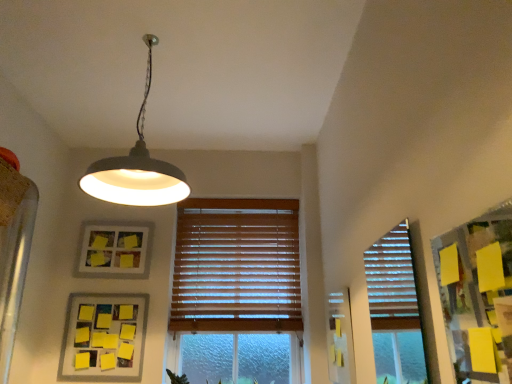
Image resolution: width=512 pixels, height=384 pixels. Describe the element at coordinates (114, 249) in the screenshot. I see `yellow matte picture frame at upper left, the first picture frame viewed from the top` at that location.

Describe the element at coordinates (136, 167) in the screenshot. I see `matte gray lampshade at upper center` at that location.

At what (x,y) coordinates should I click in order to perform the action: click on yellow matte picture frame at upper left, which appears as the 2th picture frame when viewed from the front. Please return your answer as a coordinate pair (x, y). This screenshot has width=512, height=384. Looking at the image, I should click on (114, 249).

Considering the sizes of objects yellow matte picture frame at lower left, placed as the second picture frame when sorted from top to bottom, and wooden blinds at center in the image provided, who is thinner, yellow matte picture frame at lower left, placed as the second picture frame when sorted from top to bottom, or wooden blinds at center?

yellow matte picture frame at lower left, placed as the second picture frame when sorted from top to bottom, is thinner.

Considering the relative sizes of yellow matte picture frame at lower left, which is the 2th picture frame from back to front, and wooden blinds at center in the image provided, is yellow matte picture frame at lower left, which is the 2th picture frame from back to front, bigger than wooden blinds at center?

Incorrect, yellow matte picture frame at lower left, which is the 2th picture frame from back to front, is not larger than wooden blinds at center.

The width and height of the screenshot is (512, 384). Find the location of `window that appears above the yellow matte picture frame at lower left, which appears as the 1th picture frame when viewed from the front (from the image's perspective)`. window that appears above the yellow matte picture frame at lower left, which appears as the 1th picture frame when viewed from the front (from the image's perspective) is located at coordinates (236, 266).

Between yellow matte picture frame at lower left, which is the 2th picture frame from back to front, and wooden blinds at center, which one appears on the left side from the viewer's perspective?

Positioned to the left is yellow matte picture frame at lower left, which is the 2th picture frame from back to front.

Based on the photo, does wooden blinds at center touch matte gray lampshade at upper center?

wooden blinds at center and matte gray lampshade at upper center are not in contact.

From their relative heights in the image, would you say wooden blinds at center is taller or shorter than matte gray lampshade at upper center?

Considering their sizes, wooden blinds at center has more height than matte gray lampshade at upper center.

Does wooden blinds at center have a lesser width compared to matte gray lampshade at upper center?

Yes, wooden blinds at center is thinner than matte gray lampshade at upper center.

Would you say wooden blinds at center is inside or outside matte gray lampshade at upper center?

wooden blinds at center is spatially situated outside matte gray lampshade at upper center.

How many degrees apart are the facing directions of yellow matte picture frame at upper left, the first picture frame viewed from the top, and matte gray lampshade at upper center?

yellow matte picture frame at upper left, the first picture frame viewed from the top, and matte gray lampshade at upper center are facing 5.44 degrees away from each other.

Is yellow matte picture frame at upper left, which appears as the 2th picture frame when viewed from the front, in front of or behind matte gray lampshade at upper center in the image?

Visually, yellow matte picture frame at upper left, which appears as the 2th picture frame when viewed from the front, is located behind matte gray lampshade at upper center.

From a real-world perspective, relative to matte gray lampshade at upper center, is yellow matte picture frame at upper left, the first picture frame viewed from the top, vertically above or below?

Clearly, from a real-world perspective, yellow matte picture frame at upper left, the first picture frame viewed from the top, is below matte gray lampshade at upper center.

Which is more to the right, yellow matte picture frame at upper left, which is the second picture frame in bottom-to-top order, or matte gray lampshade at upper center?

From the viewer's perspective, matte gray lampshade at upper center appears more on the right side.

Is wooden blinds at center positioned in front of yellow matte picture frame at upper left, placed as the 1th picture frame when sorted from back to front?

That is True.

Is wooden blinds at center facing towards yellow matte picture frame at upper left, which is the second picture frame in bottom-to-top order?

No, wooden blinds at center is not aimed at yellow matte picture frame at upper left, which is the second picture frame in bottom-to-top order.

Is point (248, 242) closer to camera compared to point (94, 242)?

No, it is not.

From the image's perspective, which object appears higher, wooden blinds at center or yellow matte picture frame at upper left, which is the second picture frame in bottom-to-top order?

From the image's view, yellow matte picture frame at upper left, which is the second picture frame in bottom-to-top order, is above.

Looking at this image, is wooden blinds at center facing away from yellow matte picture frame at lower left, marked as the first picture frame in a bottom-to-top arrangement?

wooden blinds at center does not have its back to yellow matte picture frame at lower left, marked as the first picture frame in a bottom-to-top arrangement.

Could you measure the distance between wooden blinds at center and yellow matte picture frame at lower left, which is the 2th picture frame from back to front?

wooden blinds at center is 21.24 inches from yellow matte picture frame at lower left, which is the 2th picture frame from back to front.

Considering the relative positions of wooden blinds at center and yellow matte picture frame at lower left, which is the 2th picture frame from back to front, in the image provided, is wooden blinds at center to the left of yellow matte picture frame at lower left, which is the 2th picture frame from back to front, from the viewer's perspective?

Incorrect, wooden blinds at center is not on the left side of yellow matte picture frame at lower left, which is the 2th picture frame from back to front.

Does wooden blinds at center have a greater width compared to yellow matte picture frame at lower left, which appears as the 1th picture frame when viewed from the front?

Yes.

Where is `the 1st picture frame behind the matte gray lampshade at upper center`? the 1st picture frame behind the matte gray lampshade at upper center is located at coordinates (104, 335).

How different are the orientations of matte gray lampshade at upper center and yellow matte picture frame at lower left, which appears as the 1th picture frame when viewed from the front, in degrees?

4.87 degrees separate the facing orientations of matte gray lampshade at upper center and yellow matte picture frame at lower left, which appears as the 1th picture frame when viewed from the front.

Can you confirm if matte gray lampshade at upper center is bigger than yellow matte picture frame at lower left, placed as the second picture frame when sorted from top to bottom?

Yes, matte gray lampshade at upper center is bigger than yellow matte picture frame at lower left, placed as the second picture frame when sorted from top to bottom.

From a real-world perspective, which object stands above the other?

From a 3D spatial view, matte gray lampshade at upper center is above.

Is matte gray lampshade at upper center beside wooden blinds at center?

matte gray lampshade at upper center and wooden blinds at center are not in contact.

Considering the relative sizes of matte gray lampshade at upper center and wooden blinds at center in the image provided, is matte gray lampshade at upper center smaller than wooden blinds at center?

No.

Considering the points (113, 202) and (224, 255), which point is behind, point (113, 202) or point (224, 255)?

The point (224, 255) is more distant.

From a real-world perspective, is matte gray lampshade at upper center over wooden blinds at center?

Yes, from a real-world perspective, matte gray lampshade at upper center is on top of wooden blinds at center.

At what (x,y) coordinates should I click in order to perform the action: click on window on the right of yellow matte picture frame at lower left, which is the 2th picture frame from back to front. Please return your answer as a coordinate pair (x, y). The height and width of the screenshot is (384, 512). Looking at the image, I should click on (236, 266).

Identify the location of window behind the matte gray lampshade at upper center. This screenshot has width=512, height=384. (236, 266).

Consider the image. Which object lies further to the anchor point yellow matte picture frame at lower left, placed as the second picture frame when sorted from top to bottom, matte gray lampshade at upper center or wooden blinds at center?

matte gray lampshade at upper center.

Which object lies nearer to the anchor point wooden blinds at center, yellow matte picture frame at upper left, placed as the 1th picture frame when sorted from back to front, or matte gray lampshade at upper center?

yellow matte picture frame at upper left, placed as the 1th picture frame when sorted from back to front.

From the picture: Considering their positions, is matte gray lampshade at upper center positioned closer to wooden blinds at center than yellow matte picture frame at upper left, the first picture frame viewed from the top?

yellow matte picture frame at upper left, the first picture frame viewed from the top.

Looking at the image, which one is located closer to yellow matte picture frame at lower left, placed as the second picture frame when sorted from top to bottom, wooden blinds at center or matte gray lampshade at upper center?

Among the two, wooden blinds at center is located nearer to yellow matte picture frame at lower left, placed as the second picture frame when sorted from top to bottom.

Looking at the image, which one is located closer to yellow matte picture frame at lower left, placed as the second picture frame when sorted from top to bottom, yellow matte picture frame at upper left, which is the second picture frame in bottom-to-top order, or wooden blinds at center?

yellow matte picture frame at upper left, which is the second picture frame in bottom-to-top order, lies closer to yellow matte picture frame at lower left, placed as the second picture frame when sorted from top to bottom, than the other object.

Looking at the image, which one is located closer to wooden blinds at center, yellow matte picture frame at upper left, placed as the 1th picture frame when sorted from back to front, or yellow matte picture frame at lower left, which is the 2th picture frame from back to front?

yellow matte picture frame at upper left, placed as the 1th picture frame when sorted from back to front.

Looking at the image, which one is located closer to matte gray lampshade at upper center, wooden blinds at center or yellow matte picture frame at lower left, which is the 2th picture frame from back to front?

The object closer to matte gray lampshade at upper center is wooden blinds at center.

Based on their spatial positions, is yellow matte picture frame at lower left, marked as the first picture frame in a bottom-to-top arrangement, or matte gray lampshade at upper center further from wooden blinds at center?

matte gray lampshade at upper center lies further to wooden blinds at center than the other object.

Where is `window located between matte gray lampshade at upper center and yellow matte picture frame at upper left, which is the second picture frame in bottom-to-top order, in the depth direction`? Image resolution: width=512 pixels, height=384 pixels. window located between matte gray lampshade at upper center and yellow matte picture frame at upper left, which is the second picture frame in bottom-to-top order, in the depth direction is located at coordinates (236, 266).

Where is `picture frame positioned between matte gray lampshade at upper center and yellow matte picture frame at upper left, placed as the 1th picture frame when sorted from back to front, from near to far`? picture frame positioned between matte gray lampshade at upper center and yellow matte picture frame at upper left, placed as the 1th picture frame when sorted from back to front, from near to far is located at coordinates (104, 335).

Where is `picture frame between yellow matte picture frame at lower left, which is the 2th picture frame from back to front, and wooden blinds at center from left to right`? The width and height of the screenshot is (512, 384). picture frame between yellow matte picture frame at lower left, which is the 2th picture frame from back to front, and wooden blinds at center from left to right is located at coordinates (114, 249).

Where is `picture frame positioned between matte gray lampshade at upper center and wooden blinds at center from near to far`? The image size is (512, 384). picture frame positioned between matte gray lampshade at upper center and wooden blinds at center from near to far is located at coordinates (104, 335).